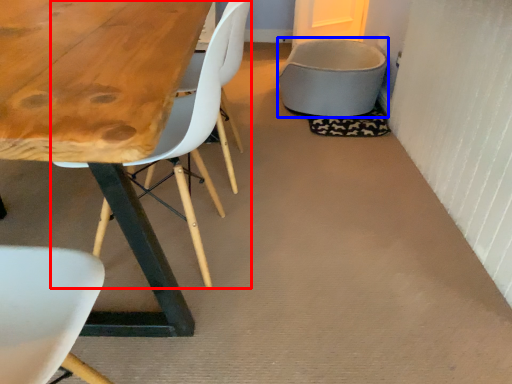
Question: Which object is closer to the camera taking this photo, chair (highlighted by a red box) or gray (highlighted by a blue box)?

Choices:
 (A) chair
 (B) gray

Answer: (A)